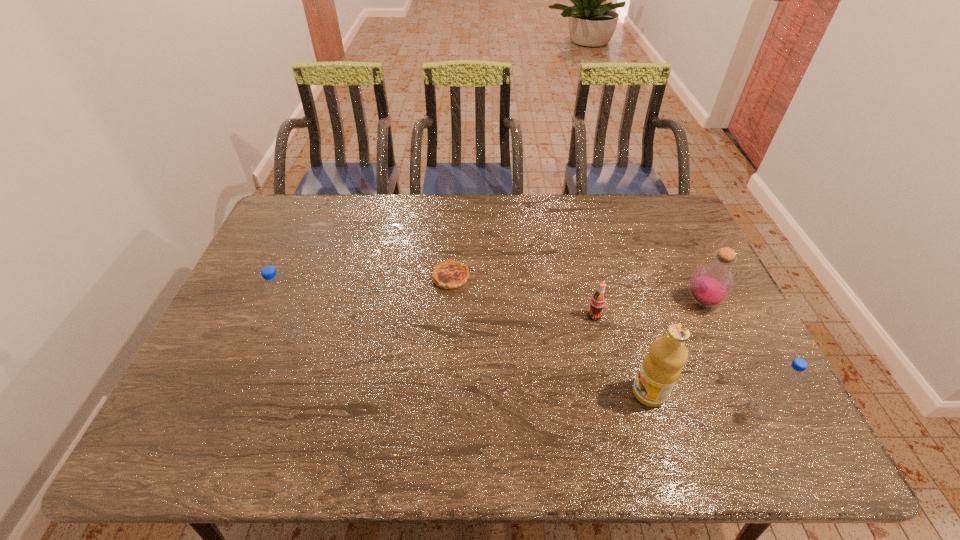
Find the location of a particular element. This screenshot has height=540, width=960. free space located on the left of the farther water bottle is located at coordinates (245, 336).

Where is `free space located 0.170m on the back of the right water bottle`? The width and height of the screenshot is (960, 540). free space located 0.170m on the back of the right water bottle is located at coordinates (727, 343).

Identify the location of free space located 0.130m on the right of the quiche. The image size is (960, 540). (512, 277).

Find the location of a particular element. vacant point located on the left of the bottle is located at coordinates (590, 302).

Identify the location of vacant space located on the left of the third object from left to right. (481, 316).

The width and height of the screenshot is (960, 540). I want to click on free point located on the label of the third object from right to left, so click(x=484, y=393).

Identify the location of free location located on the label of the third object from right to left. This screenshot has height=540, width=960. (513, 393).

I want to click on vacant point located on the label of the third object from right to left, so click(488, 393).

You are a GUI agent. You are given a task and a screenshot of the screen. Output one action in this format:
    pyautogui.click(x=<x>, y=<y>)
    Task: Click on the water bottle situated at the near edge
    The image size is (960, 540).
    Given the screenshot: What is the action you would take?
    pyautogui.click(x=784, y=382)

Find the location of a particular element. Image resolution: width=960 pixels, height=540 pixels. olive oil that is at the near edge is located at coordinates (661, 368).